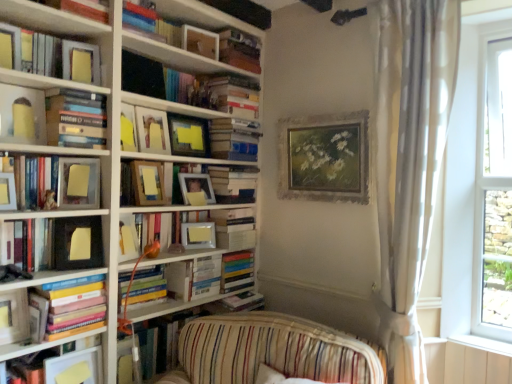
Question: Is matte wooden picture frame at upper center, the fifth picture frame viewed from the left, oriented away from gold-framed painting at upper center, arranged as the tenth picture frame when viewed from the left?

Choices:
 (A) yes
 (B) no

Answer: (B)

Question: Is matte wooden picture frame at upper center, the fifth picture frame viewed from the left, surrounding gold-framed painting at upper center, which ranks as the 1th picture frame in right-to-left order?

Choices:
 (A) yes
 (B) no

Answer: (B)

Question: From the image's perspective, does matte wooden picture frame at upper center, the fifth picture frame viewed from the left, appear higher than gold-framed painting at upper center, arranged as the tenth picture frame when viewed from the left?

Choices:
 (A) yes
 (B) no

Answer: (A)

Question: Is matte wooden picture frame at upper center, the fifth picture frame viewed from the left, not close to gold-framed painting at upper center, which ranks as the 1th picture frame in right-to-left order?

Choices:
 (A) no
 (B) yes

Answer: (A)

Question: Considering the relative positions of matte wooden picture frame at upper center, acting as the 6th picture frame starting from the right, and gold-framed painting at upper center, which ranks as the 1th picture frame in right-to-left order, in the image provided, is matte wooden picture frame at upper center, acting as the 6th picture frame starting from the right, in front of gold-framed painting at upper center, which ranks as the 1th picture frame in right-to-left order,?

Choices:
 (A) no
 (B) yes

Answer: (A)

Question: In the image, is matte silver picture frame at left, which is counted as the tenth picture frame, starting from the right, positioned in front of or behind wooden frame at center, the second shelf ordered from the bottom?

Choices:
 (A) front
 (B) behind

Answer: (A)

Question: Does point (12, 183) appear closer or farther from the camera than point (168, 198)?

Choices:
 (A) farther
 (B) closer

Answer: (B)

Question: Is matte silver picture frame at left, which is counted as the tenth picture frame, starting from the right, bigger or smaller than wooden frame at center, the second shelf ordered from the bottom?

Choices:
 (A) big
 (B) small

Answer: (B)

Question: From the image's perspective, is matte silver picture frame at left, positioned as the 1th picture frame in left-to-right order, above or below wooden frame at center, which is counted as the 1th shelf, starting from the top?

Choices:
 (A) below
 (B) above

Answer: (A)

Question: Is point (219, 74) closer or farther from the camera than point (170, 147)?

Choices:
 (A) farther
 (B) closer

Answer: (A)

Question: From the image's perspective, is matte black book at upper center, which appears as the 11th book when ordered from the bottom, located above or below matte yellow paper at upper center, the sixth picture frame from the left?

Choices:
 (A) below
 (B) above

Answer: (B)

Question: From a real-world perspective, is matte black book at upper center, which is the 5th book from top to bottom, physically located above or below matte yellow paper at upper center, the 5th picture frame viewed from the right?

Choices:
 (A) above
 (B) below

Answer: (A)

Question: Visually, is matte black book at upper center, which is the 5th book from top to bottom, positioned to the left or to the right of matte yellow paper at upper center, the 5th picture frame viewed from the right?

Choices:
 (A) right
 (B) left

Answer: (B)

Question: Is wooden picture frame at center, which is counted as the 4th picture frame, starting from the left, inside the boundaries of matte black picture frame at upper left, positioned as the second picture frame in left-to-right order, or outside?

Choices:
 (A) outside
 (B) inside

Answer: (A)

Question: In the image, is wooden picture frame at center, which is counted as the 4th picture frame, starting from the left, on the left side or the right side of matte black picture frame at upper left, positioned as the second picture frame in left-to-right order?

Choices:
 (A) right
 (B) left

Answer: (A)